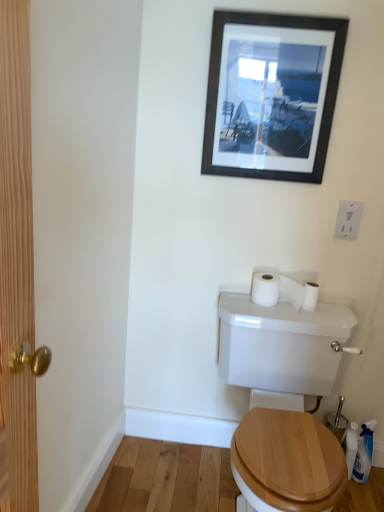
This screenshot has width=384, height=512. I want to click on vacant space to the left of white matte toilet paper at upper right, the 2th toilet paper positioned from the left, so click(273, 307).